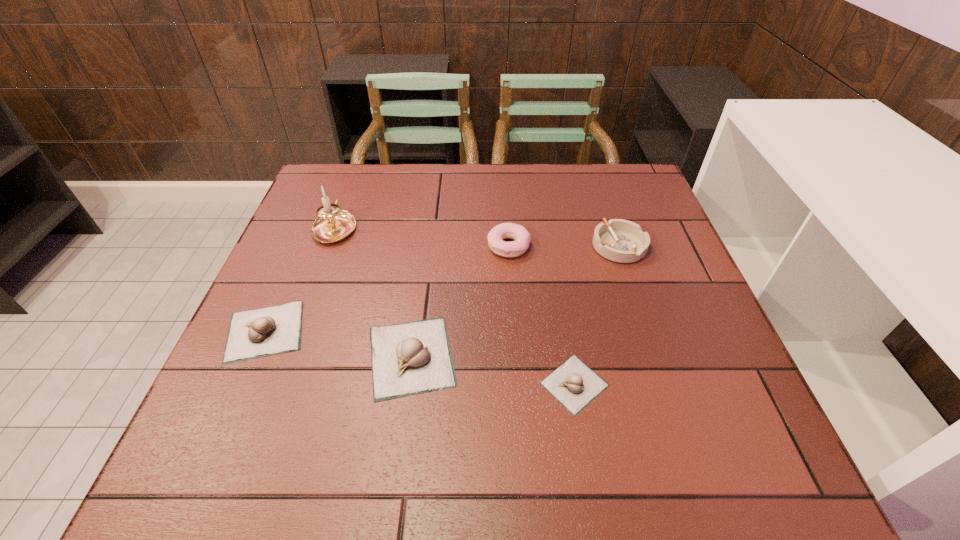
Find the location of a particular element. free space between the doughnut and the rightmost object is located at coordinates (564, 246).

What are the coordinates of `vacant area that lies between the second shortest garlic and the second garlic from left to right` in the screenshot? It's located at (338, 344).

The width and height of the screenshot is (960, 540). What are the coordinates of `free space between the doughnut and the tallest object` in the screenshot? It's located at (421, 237).

The width and height of the screenshot is (960, 540). I want to click on unoccupied position between the leftmost garlic and the rightmost object, so click(x=442, y=288).

Point out which object is positioned as the fifth nearest to the second shortest garlic. Please provide its 2D coordinates. Your answer should be formatted as a tuple, i.e. [(x, y)], where the tuple contains the x and y coordinates of a point satisfying the conditions above.

[(623, 241)]

At what (x,y) coordinates should I click in order to perform the action: click on the closest object to the rightmost object. Please return your answer as a coordinate pair (x, y). Looking at the image, I should click on (495, 237).

The image size is (960, 540). Identify the location of garlic that is the closest one to the doughnut. (410, 358).

The width and height of the screenshot is (960, 540). What are the coordinates of `garlic that stands as the closest to the second garlic from right to left` in the screenshot? It's located at (255, 333).